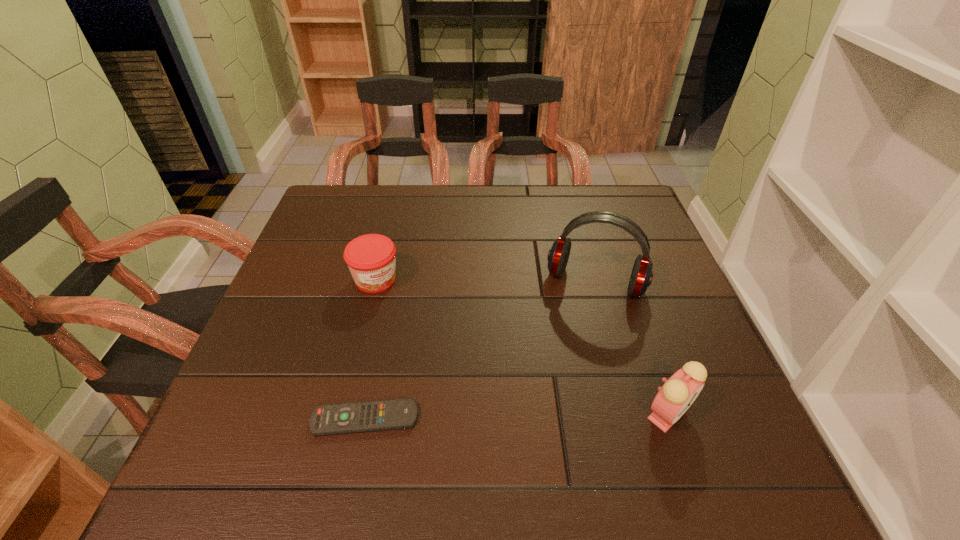
Where is `vacant space at the far right corner of the desktop`? vacant space at the far right corner of the desktop is located at coordinates (637, 205).

The height and width of the screenshot is (540, 960). Find the location of `free space between the jam and the third shortest object`. free space between the jam and the third shortest object is located at coordinates (522, 347).

Where is `vacant space that's between the second shortest object and the alarm clock`? This screenshot has width=960, height=540. vacant space that's between the second shortest object and the alarm clock is located at coordinates (522, 347).

Find the location of a particular element. This screenshot has width=960, height=540. free point between the third shortest object and the remote control is located at coordinates (516, 416).

This screenshot has height=540, width=960. Identify the location of free space between the remote control and the earphone. (480, 350).

This screenshot has height=540, width=960. Find the location of `free spot between the alarm clock and the remote control`. free spot between the alarm clock and the remote control is located at coordinates (516, 416).

Identify the location of free space that is in between the shortest object and the second shortest object. (371, 349).

This screenshot has width=960, height=540. Find the location of `empty space that is in between the jam and the tallest object`. empty space that is in between the jam and the tallest object is located at coordinates (486, 281).

Locate an element on the screen. The width and height of the screenshot is (960, 540). free space between the shortest object and the earphone is located at coordinates (480, 350).

Locate an element on the screen. free space between the earphone and the shortest object is located at coordinates (480, 350).